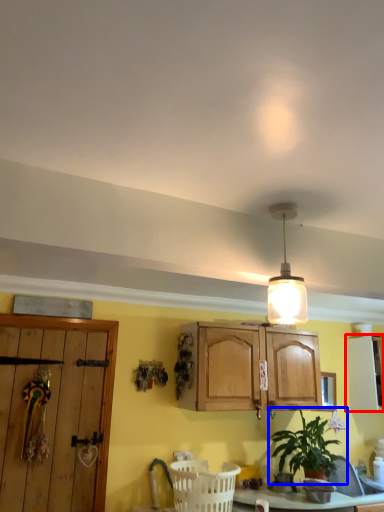
Question: Which object appears farthest to the camera in this image, cabinetry (highlighted by a red box) or houseplant (highlighted by a blue box)?

Choices:
 (A) cabinetry
 (B) houseplant

Answer: (A)